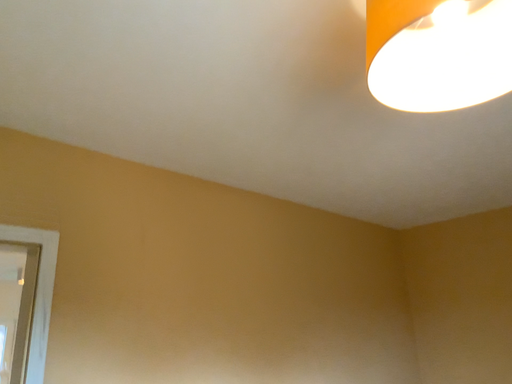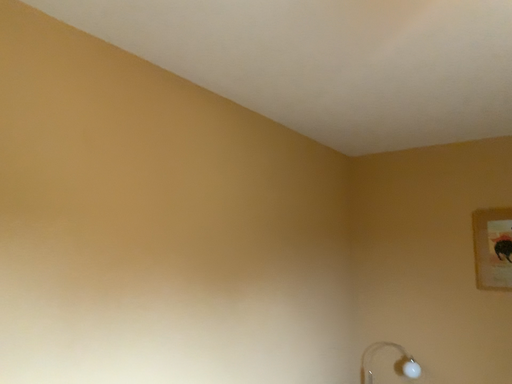
Question: How did the camera likely rotate when shooting the video?

Choices:
 (A) rotated left
 (B) rotated right

Answer: (B)